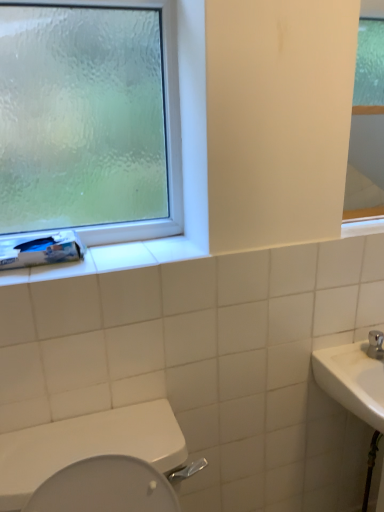
Image resolution: width=384 pixels, height=512 pixels. Describe the element at coordinates (40, 249) in the screenshot. I see `white matte toilet paper at left` at that location.

Describe the element at coordinates (88, 446) in the screenshot. This screenshot has width=384, height=512. I see `white glossy toilet at lower left` at that location.

You are a GUI agent. You are given a task and a screenshot of the screen. Output one action in this format:
    pyautogui.click(x=<x>, y=<y>)
    Task: Click on the white matte toilet paper at left
    Image resolution: width=384 pixels, height=512 pixels.
    Given the screenshot: What is the action you would take?
    pyautogui.click(x=40, y=249)

From their relative heights in the image, would you say white glossy toilet at lower left is taller or shorter than white matte toilet paper at left?

In the image, white glossy toilet at lower left appears to be taller than white matte toilet paper at left.

Is point (28, 475) positioned after point (44, 258)?

No.

From the image's perspective, is white glossy toilet at lower left located above or below white matte toilet paper at left?

white glossy toilet at lower left is below white matte toilet paper at left.

Is white glossy mirror at upper right shorter than white glossy toilet at lower left?

Correct, white glossy mirror at upper right is not as tall as white glossy toilet at lower left.

Is white glossy mirror at upper right turned away from white glossy toilet at lower left?

No, white glossy mirror at upper right's orientation is not away from white glossy toilet at lower left.

Is white glossy mirror at upper right outside of white glossy toilet at lower left?

white glossy mirror at upper right lies outside white glossy toilet at lower left's area.

Based on the photo, from a real-world perspective, relative to white glossy toilet at lower left, is white glossy mirror at upper right vertically above or below?

Clearly, from a real-world perspective, white glossy mirror at upper right is above white glossy toilet at lower left.

Is white matte toilet paper at left completely or partially outside of white glossy toilet at lower left?

That's correct, white matte toilet paper at left is outside of white glossy toilet at lower left.

Which of these two, white matte toilet paper at left or white glossy toilet at lower left, is smaller?

white matte toilet paper at left.

Looking at this image, is white matte toilet paper at left to the right of white glossy toilet at lower left from the viewer's perspective?

Incorrect, white matte toilet paper at left is not on the right side of white glossy toilet at lower left.

Which object is closer to the camera, frosted glass window at upper left or white glossy mirror at upper right?

frosted glass window at upper left is closer to the camera.

Which of these two, frosted glass window at upper left or white glossy mirror at upper right, stands shorter?

white glossy mirror at upper right.

Between frosted glass window at upper left and white glossy mirror at upper right, which one has smaller size?

white glossy mirror at upper right.

From the image's perspective, is frosted glass window at upper left beneath white glossy mirror at upper right?

No, from the image's perspective, frosted glass window at upper left is not below white glossy mirror at upper right.

Is white matte toilet paper at left inside or outside of frosted glass window at upper left?

white matte toilet paper at left exists outside the volume of frosted glass window at upper left.

From the image's perspective, is white matte toilet paper at left located beneath frosted glass window at upper left?

Yes.

Does white matte toilet paper at left have a greater height compared to frosted glass window at upper left?

In fact, white matte toilet paper at left may be shorter than frosted glass window at upper left.

Is frosted glass window at upper left positioned with its back to white glossy toilet at lower left?

No, white glossy toilet at lower left is not at the back of frosted glass window at upper left.

Considering the sizes of objects frosted glass window at upper left and white glossy toilet at lower left in the image provided, who is bigger, frosted glass window at upper left or white glossy toilet at lower left?

white glossy toilet at lower left is bigger.

Which is in front, frosted glass window at upper left or white glossy toilet at lower left?

white glossy toilet at lower left is more forward.

Is frosted glass window at upper left shorter than white glossy toilet at lower left?

Incorrect, the height of frosted glass window at upper left does not fall short of that of white glossy toilet at lower left.

Which object is closer to the camera taking this photo, white glossy toilet at lower left or frosted glass window at upper left?

white glossy toilet at lower left is in front.

From a real-world perspective, is white glossy toilet at lower left physically located above or below frosted glass window at upper left?

white glossy toilet at lower left is below frosted glass window at upper left.

Locate an element on the screen. The height and width of the screenshot is (512, 384). toilet paper located above the white glossy toilet at lower left (from a real-world perspective) is located at coordinates (40, 249).

At what (x,y) coordinates should I click in order to perform the action: click on toilet below the white glossy mirror at upper right (from the image's perspective). Please return your answer as a coordinate pair (x, y). Looking at the image, I should click on (88, 446).

Looking at the image, which one is located closer to white glossy toilet at lower left, white glossy mirror at upper right or frosted glass window at upper left?

frosted glass window at upper left is closer to white glossy toilet at lower left.

Considering their positions, is white matte toilet paper at left positioned closer to white glossy mirror at upper right than white glossy toilet at lower left?

Among the two, white matte toilet paper at left is located nearer to white glossy mirror at upper right.

Based on their spatial positions, is frosted glass window at upper left or white glossy mirror at upper right further from white glossy toilet at lower left?

white glossy mirror at upper right is further to white glossy toilet at lower left.

From the image, which object appears to be farther from white glossy mirror at upper right, frosted glass window at upper left or white glossy toilet at lower left?

Among the two, white glossy toilet at lower left is located further to white glossy mirror at upper right.

In the scene shown: Which object lies further to the anchor point white glossy mirror at upper right, white matte toilet paper at left or frosted glass window at upper left?

Based on the image, white matte toilet paper at left appears to be further to white glossy mirror at upper right.

From the image, which object appears to be nearer to white glossy toilet at lower left, frosted glass window at upper left or white matte toilet paper at left?

white matte toilet paper at left.

When comparing their distances from white matte toilet paper at left, does white glossy toilet at lower left or frosted glass window at upper left seem further?

white glossy toilet at lower left is positioned further to the anchor white matte toilet paper at left.

Estimate the real-world distances between objects in this image. Which object is closer to white matte toilet paper at left, white glossy mirror at upper right or white glossy toilet at lower left?

white glossy toilet at lower left lies closer to white matte toilet paper at left than the other object.

The width and height of the screenshot is (384, 512). I want to click on window located between white matte toilet paper at left and white glossy mirror at upper right in the left-right direction, so click(167, 142).

The image size is (384, 512). Identify the location of mirror that lies between frosted glass window at upper left and white glossy toilet at lower left from top to bottom. (365, 164).

Where is `toilet between white matte toilet paper at left and white glossy mirror at upper right in the horizontal direction`? toilet between white matte toilet paper at left and white glossy mirror at upper right in the horizontal direction is located at coordinates (88, 446).

Where is `toilet paper between frosted glass window at upper left and white glossy toilet at lower left from top to bottom`? The height and width of the screenshot is (512, 384). toilet paper between frosted glass window at upper left and white glossy toilet at lower left from top to bottom is located at coordinates (40, 249).